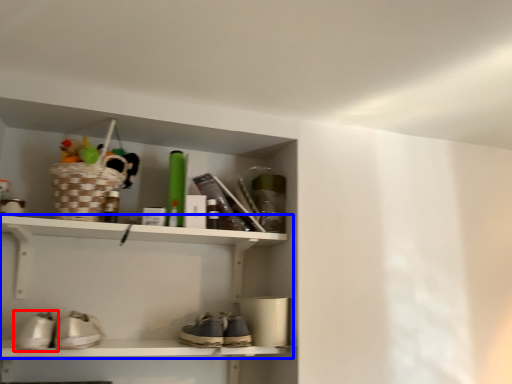
Question: Which point is closer to the camera, footwear (highlighted by a red box) or shelf (highlighted by a blue box)?

Choices:
 (A) footwear
 (B) shelf

Answer: (A)